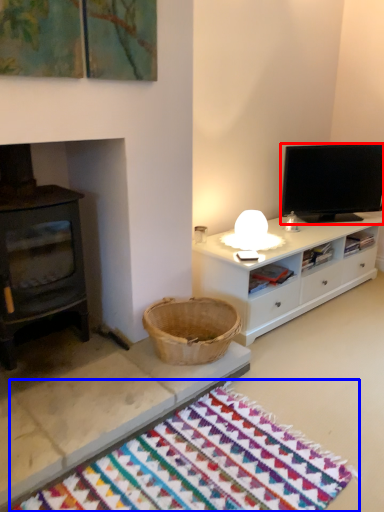
Question: Which object appears farthest to the camera in this image, television (highlighted by a red box) or mat (highlighted by a blue box)?

Choices:
 (A) television
 (B) mat

Answer: (A)